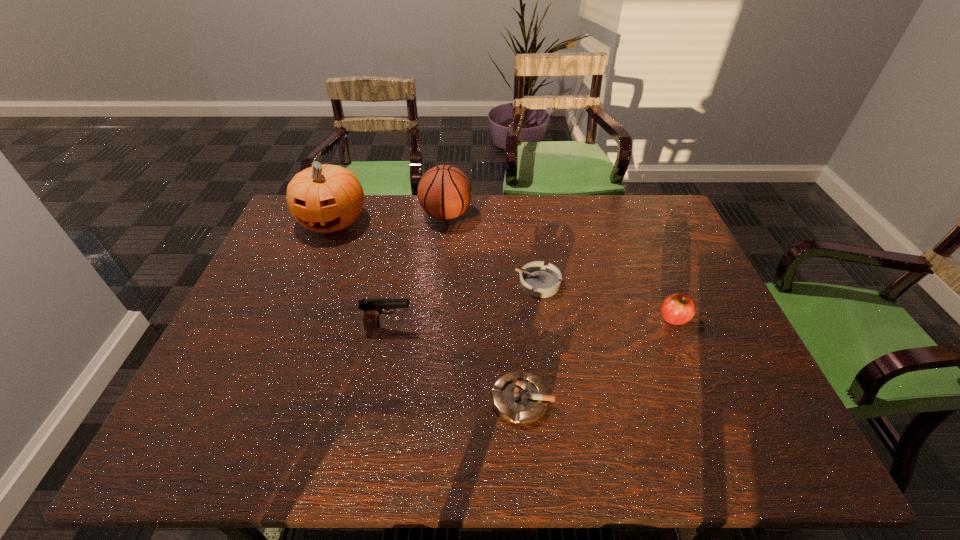
Find the location of a particular element. This screenshot has height=540, width=960. the leftmost object is located at coordinates (325, 198).

What are the coordinates of `pumpkin` in the screenshot? It's located at (325, 198).

Locate an element on the screen. The width and height of the screenshot is (960, 540). the second tallest object is located at coordinates (444, 192).

This screenshot has width=960, height=540. Find the location of `the fourth shortest object`. the fourth shortest object is located at coordinates (372, 308).

Identify the location of the third shortest object. This screenshot has width=960, height=540. (677, 309).

Find the location of `apple`. apple is located at coordinates (677, 309).

Find the location of a particular element. The height and width of the screenshot is (540, 960). the fourth nearest object is located at coordinates (538, 280).

In order to click on the nearest object in this screenshot , I will do `click(520, 398)`.

The image size is (960, 540). I want to click on free space located 0.180m on the front-facing side of the leftmost object, so click(307, 284).

At what (x,y) coordinates should I click in order to perform the action: click on free space located 0.080m on the side where the inflation valve is located. Please return your answer as a coordinate pair (x, y). Looking at the image, I should click on (496, 215).